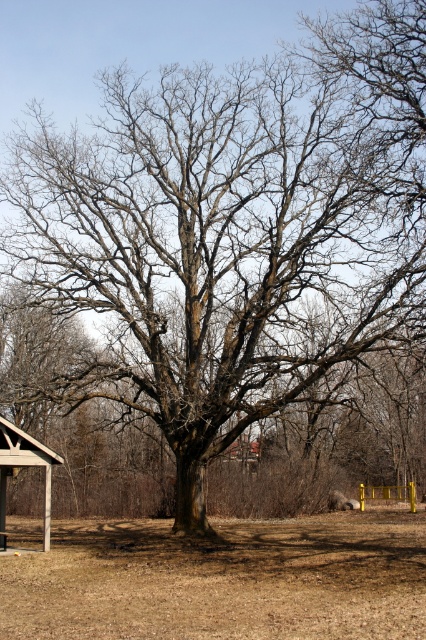
Question: Can you confirm if brown dry soil at center is positioned to the left of wooden picnic table at lower left?

Choices:
 (A) yes
 (B) no

Answer: (B)

Question: Which point is farther to the camera?

Choices:
 (A) wooden picnic table at lower left
 (B) brown dry soil at center

Answer: (A)

Question: Is the position of brown dry soil at center less distant than that of wooden picnic table at lower left?

Choices:
 (A) yes
 (B) no

Answer: (A)

Question: Which point appears farthest from the camera in this image?

Choices:
 (A) (282, 529)
 (B) (0, 428)

Answer: (A)

Question: Observing the image, what is the correct spatial positioning of brown dry soil at center in reference to wooden picnic table at lower left?

Choices:
 (A) right
 (B) left

Answer: (A)